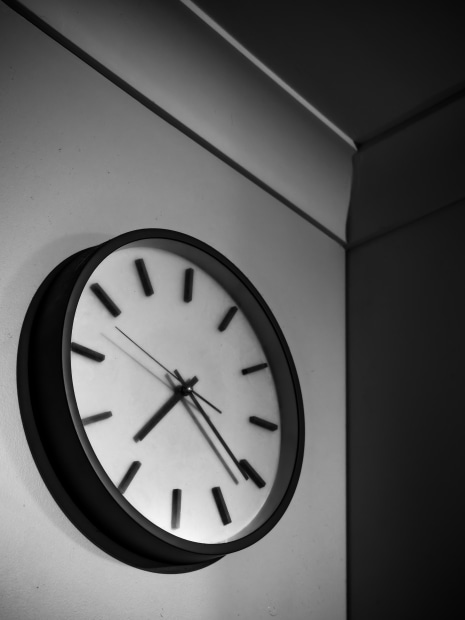
What are the coordinates of `black clock body` in the screenshot? It's located at (70, 464).